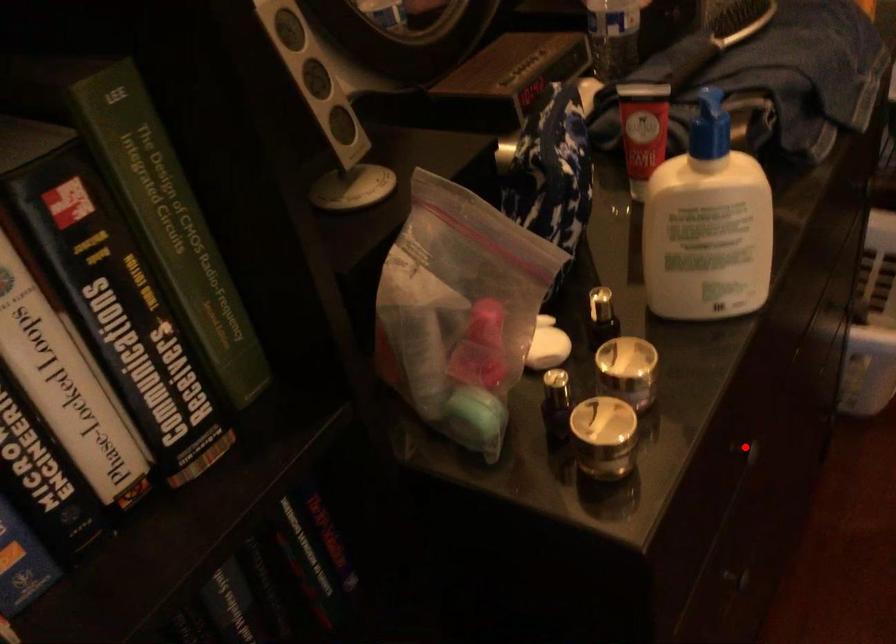
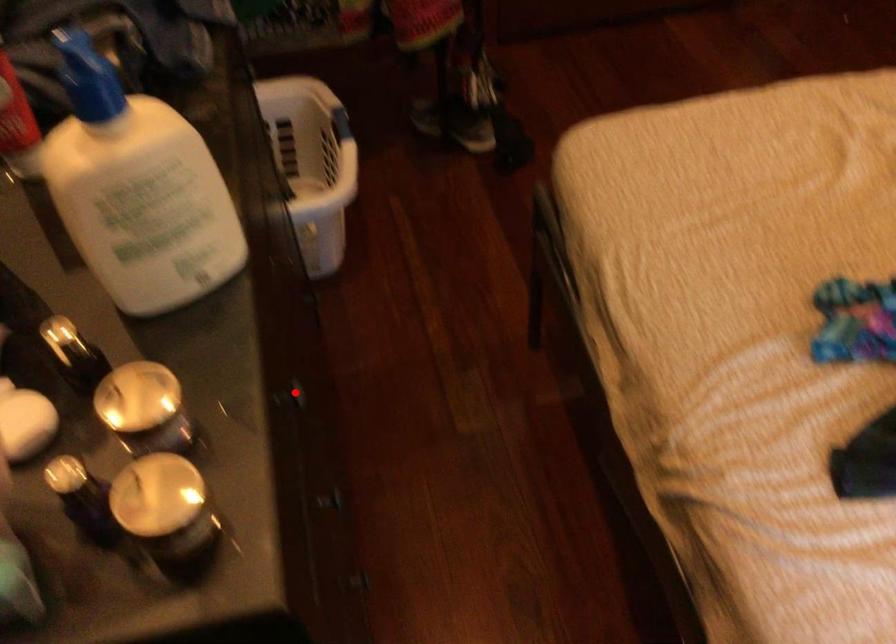
I am providing you with two images of the same scene from different viewpoints. A red point is marked on the first image and another point is marked on the second image. Do the highlighted points in image1 and image2 indicate the same real-world spot?

Yes